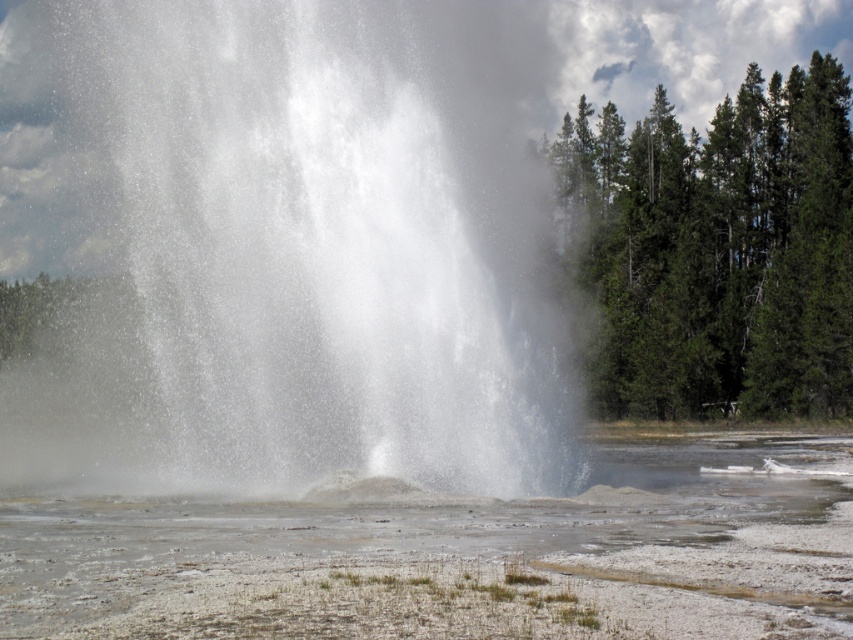
Question: Which point is farther from the camera taking this photo?

Choices:
 (A) (323, 24)
 (B) (86, 531)

Answer: (A)

Question: Which point is farther to the camera?

Choices:
 (A) (792, 561)
 (B) (242, 445)

Answer: (B)

Question: From the image, what is the correct spatial relationship of white vapor at center in relation to white frothy water at center?

Choices:
 (A) above
 (B) below

Answer: (A)

Question: Is the position of white vapor at center less distant than that of white frothy water at center?

Choices:
 (A) no
 (B) yes

Answer: (A)

Question: Does white vapor at center lie in front of white frothy water at center?

Choices:
 (A) yes
 (B) no

Answer: (B)

Question: Which object appears closest to the camera in this image?

Choices:
 (A) white vapor at center
 (B) white frothy water at center

Answer: (B)